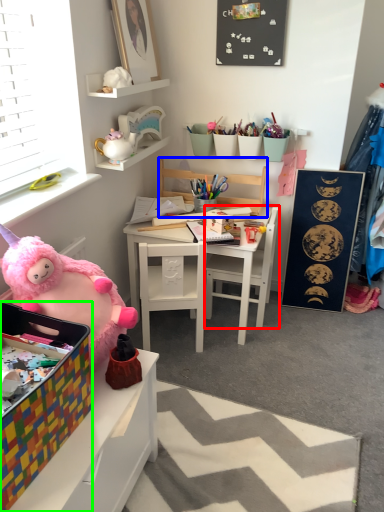
Question: Which object is the farthest from chair (highlighted by a red box)? Choose among these: chair (highlighted by a blue box) or box (highlighted by a green box).

Choices:
 (A) chair
 (B) box

Answer: (B)